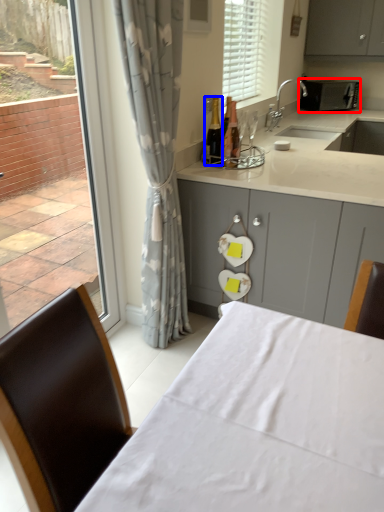
Question: Among these objects, which one is nearest to the camera, appliance (highlighted by a red box) or bottle (highlighted by a blue box)?

Choices:
 (A) appliance
 (B) bottle

Answer: (B)